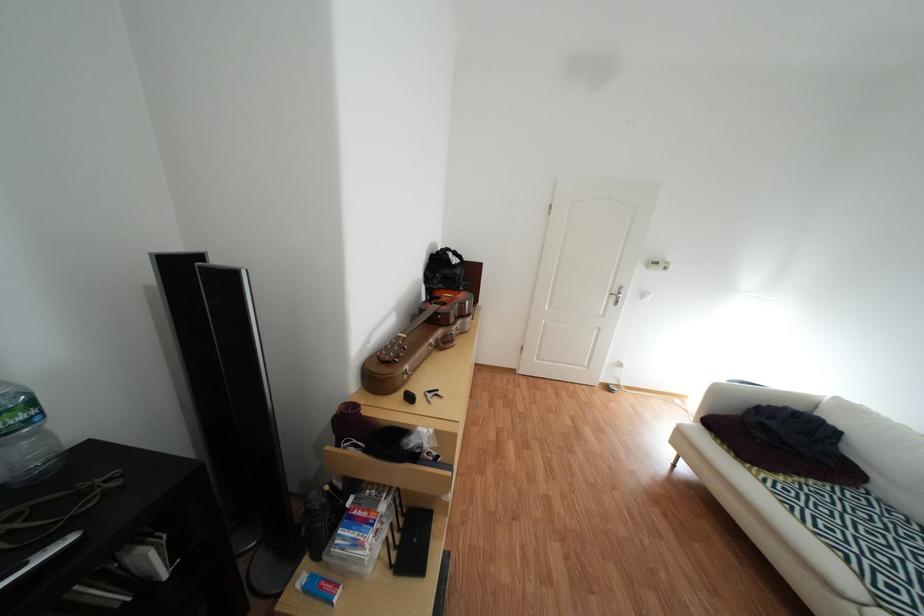
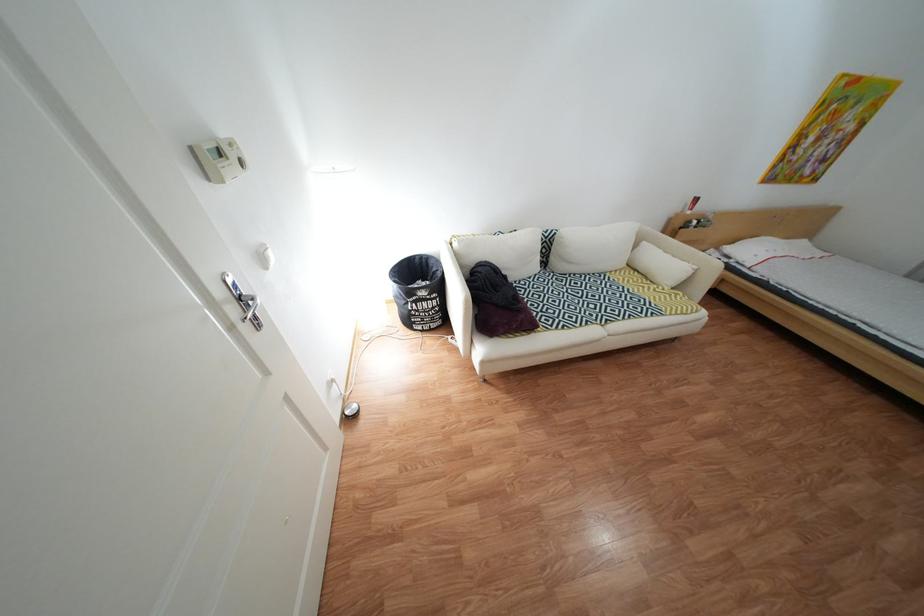
Where in the second image is the point corresponding to point (883, 487) from the first image?

(525, 281)